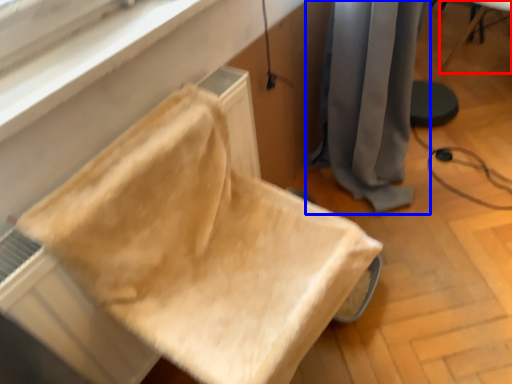
Question: Among these objects, which one is nearest to the camera, furniture (highlighted by a red box) or curtain (highlighted by a blue box)?

Choices:
 (A) furniture
 (B) curtain

Answer: (B)